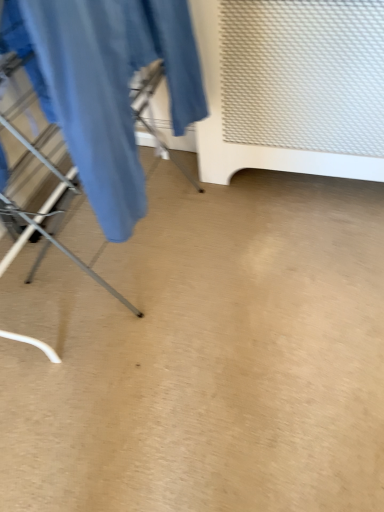
This screenshot has height=512, width=384. Describe the element at coordinates (111, 88) in the screenshot. I see `matte blue fabric at left` at that location.

Identify the location of matte blue fabric at left. (111, 88).

Describe the element at coordinates (291, 87) in the screenshot. I see `white textured radiator at upper right` at that location.

In order to face white textured radiator at upper right, should I rotate leftwards or rightwards?

Rotate your view right by about 14.159°.

Where is `white textured radiator at upper right`? This screenshot has width=384, height=512. white textured radiator at upper right is located at coordinates (291, 87).

Measure the distance between white textured radiator at upper right and camera.

A distance of 1.08 meters exists between white textured radiator at upper right and camera.

Identify the location of matte blue fabric at left. This screenshot has width=384, height=512. (111, 88).

Based on the photo, which object is positioned more to the left, white textured radiator at upper right or matte blue fabric at left?

matte blue fabric at left.

Which object is further away from the camera, white textured radiator at upper right or matte blue fabric at left?

white textured radiator at upper right is further from the camera.

Does point (341, 135) come closer to viewer compared to point (100, 204)?

No, it is not.

From the image's perspective, is white textured radiator at upper right located above matte blue fabric at left?

Yes, from the image's perspective, white textured radiator at upper right is over matte blue fabric at left.

From a real-world perspective, is white textured radiator at upper right physically located above or below matte blue fabric at left?

white textured radiator at upper right is situated lower than matte blue fabric at left in the real world.

Between white textured radiator at upper right and matte blue fabric at left, which one has smaller width?

matte blue fabric at left is thinner.

Does white textured radiator at upper right have a lesser height compared to matte blue fabric at left?

Incorrect, the height of white textured radiator at upper right does not fall short of that of matte blue fabric at left.

Is white textured radiator at upper right smaller than matte blue fabric at left?

Actually, white textured radiator at upper right might be larger than matte blue fabric at left.

Choose the correct answer: Is white textured radiator at upper right inside matte blue fabric at left or outside it?

white textured radiator at upper right is not enclosed by matte blue fabric at left.

Is white textured radiator at upper right directly adjacent to matte blue fabric at left?

No, white textured radiator at upper right is not making contact with matte blue fabric at left.

Could you tell me if white textured radiator at upper right is turned towards matte blue fabric at left?

Yes, white textured radiator at upper right is turned towards matte blue fabric at left.

How many degrees apart are the facing directions of white textured radiator at upper right and matte blue fabric at left?

The angle between the facing direction of white textured radiator at upper right and the facing direction of matte blue fabric at left is 87.2 degrees.

Identify the location of clothing that appears in front of the white textured radiator at upper right. (111, 88).

Is matte blue fabric at left to the left of white textured radiator at upper right from the viewer's perspective?

Indeed, matte blue fabric at left is positioned on the left side of white textured radiator at upper right.

In the image, is matte blue fabric at left positioned in front of or behind white textured radiator at upper right?

Clearly, matte blue fabric at left is in front of white textured radiator at upper right.

Considering the points (6, 20) and (206, 173), which point is behind, point (6, 20) or point (206, 173)?

Positioned behind is point (206, 173).

From the image's perspective, which is below, matte blue fabric at left or white textured radiator at upper right?

matte blue fabric at left.

From a real-world perspective, relative to white textured radiator at upper right, is matte blue fabric at left vertically above or below?

In terms of real-world spatial position, matte blue fabric at left is above white textured radiator at upper right.

Which object is wider, matte blue fabric at left or white textured radiator at upper right?

white textured radiator at upper right.

Who is taller, matte blue fabric at left or white textured radiator at upper right?

white textured radiator at upper right is taller.

Considering the sizes of matte blue fabric at left and white textured radiator at upper right in the image, is matte blue fabric at left bigger or smaller than white textured radiator at upper right?

Considering their sizes, matte blue fabric at left takes up less space than white textured radiator at upper right.

Is white textured radiator at upper right completely or partially inside matte blue fabric at left?

No, white textured radiator at upper right is not a part of matte blue fabric at left.

In the scene shown: Is the surface of matte blue fabric at left in direct contact with white textured radiator at upper right?

No, matte blue fabric at left is not making contact with white textured radiator at upper right.

Is matte blue fabric at left facing towards white textured radiator at upper right?

No, matte blue fabric at left does not turn towards white textured radiator at upper right.

The width and height of the screenshot is (384, 512). Identify the location of clothing on the left side of white textured radiator at upper right. (111, 88).

Identify the location of clothing in front of the white textured radiator at upper right. (111, 88).

The image size is (384, 512). Identify the location of clothing that is below the white textured radiator at upper right (from the image's perspective). (111, 88).